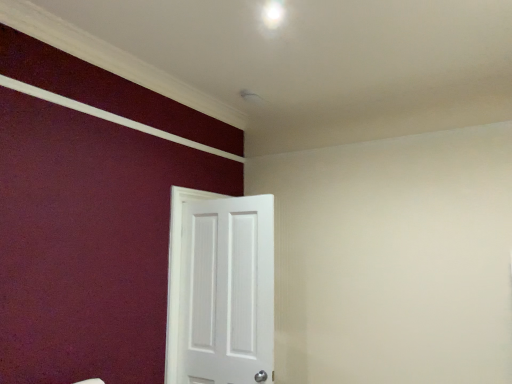
Image resolution: width=512 pixels, height=384 pixels. Describe the element at coordinates (220, 289) in the screenshot. I see `white wood door at center` at that location.

I want to click on white wood door at center, so click(x=220, y=289).

This screenshot has width=512, height=384. I want to click on white wood door at center, so click(x=220, y=289).